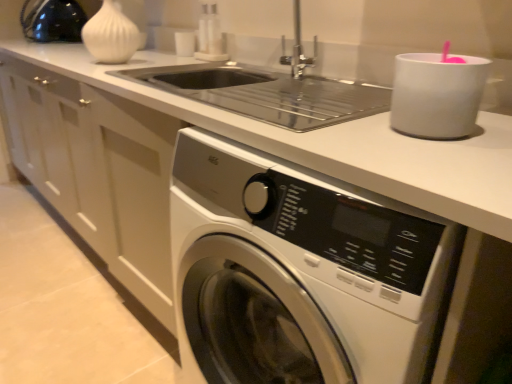
Question: From a real-world perspective, is matte black kettle at upper left, acting as the 2th appliance starting from the bottom, physically located above or below white matte cup at upper right, positioned as the second appliance in back-to-front order?

Choices:
 (A) above
 (B) below

Answer: (A)

Question: Is matte black kettle at upper left, acting as the 2th appliance starting from the bottom, inside or outside of white matte cup at upper right, the first appliance in the bottom-to-top sequence?

Choices:
 (A) outside
 (B) inside

Answer: (A)

Question: Which object is the closest to the white glossy washing machine at lower center?

Choices:
 (A) white matte cup at upper right, which is counted as the 1th appliance, starting from the right
 (B) white matte vase at upper left
 (C) matte black kettle at upper left, which appears as the 1th appliance when viewed from the back

Answer: (A)

Question: Based on their relative distances, which object is farther from the white matte cup at upper right, positioned as the second appliance in back-to-front order?

Choices:
 (A) matte black kettle at upper left, which appears as the first appliance when viewed from the top
 (B) white glossy washing machine at lower center
 (C) white matte vase at upper left

Answer: (A)